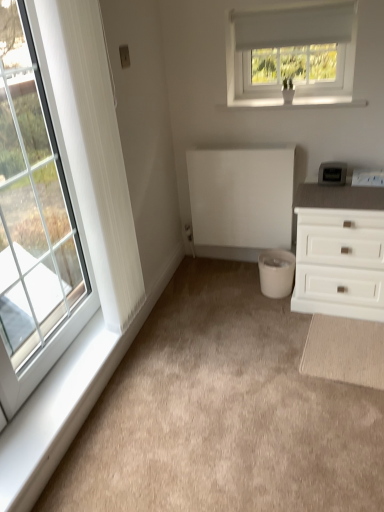
Question: In terms of height, does white glass window at left, the 1th window in the left-to-right sequence, look taller or shorter compared to white matte radiator at center?

Choices:
 (A) short
 (B) tall

Answer: (B)

Question: From a real-world perspective, is white glass window at left, the second window from the right, above or below white matte radiator at center?

Choices:
 (A) above
 (B) below

Answer: (A)

Question: Estimate the real-world distances between objects in this image. Which object is farther from the white matte chest of drawers at right?

Choices:
 (A) white matte radiator at center
 (B) white fabric window at upper center, which is the second window from bottom to top
 (C) white textured curtain at left
 (D) beige carpet at center
 (E) white plastic window sill at upper center, which is the second window sill in left-to-right order

Answer: (C)

Question: Estimate the real-world distances between objects in this image. Which object is farther from the white matte radiator at center?

Choices:
 (A) white plastic window sill at upper center, which is the second window sill in left-to-right order
 (B) white fabric window at upper center, which is the second window from bottom to top
 (C) white plastic window sill at lower left, which is the first window sill from bottom to top
 (D) beige carpet at center
 (E) white matte chest of drawers at right

Answer: (C)